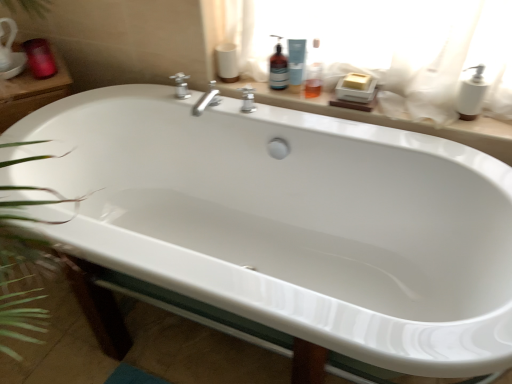
Question: Are white matte toilet paper at upper center and blue plastic bottle at upper center, acting as the second cleaning product starting from the left, located far from each other?

Choices:
 (A) yes
 (B) no

Answer: (B)

Question: Can we say white matte toilet paper at upper center lies outside blue plastic bottle at upper center, acting as the second cleaning product starting from the left?

Choices:
 (A) yes
 (B) no

Answer: (A)

Question: From a real-world perspective, is white matte toilet paper at upper center over blue plastic bottle at upper center, the first cleaning product in the right-to-left sequence?

Choices:
 (A) no
 (B) yes

Answer: (A)

Question: Does white matte toilet paper at upper center have a smaller size compared to blue plastic bottle at upper center, the first cleaning product in the right-to-left sequence?

Choices:
 (A) no
 (B) yes

Answer: (A)

Question: Considering the relative sizes of white matte toilet paper at upper center and blue plastic bottle at upper center, acting as the second cleaning product starting from the left, in the image provided, is white matte toilet paper at upper center shorter than blue plastic bottle at upper center, acting as the second cleaning product starting from the left,?

Choices:
 (A) yes
 (B) no

Answer: (A)

Question: Is matte red candle at upper left taller or shorter than translucent plastic bottle at upper center, placed as the 2th cleaning product when sorted from right to left?

Choices:
 (A) tall
 (B) short

Answer: (B)

Question: Visually, is matte red candle at upper left positioned to the left or to the right of translucent plastic bottle at upper center, acting as the 1th cleaning product starting from the left?

Choices:
 (A) right
 (B) left

Answer: (B)

Question: From the image's perspective, is matte red candle at upper left positioned above or below translucent plastic bottle at upper center, placed as the 2th cleaning product when sorted from right to left?

Choices:
 (A) above
 (B) below

Answer: (A)

Question: Looking at the image, does matte red candle at upper left seem bigger or smaller compared to translucent plastic bottle at upper center, placed as the 2th cleaning product when sorted from right to left?

Choices:
 (A) big
 (B) small

Answer: (A)

Question: Based on their sizes in the image, would you say white plastic soap dispenser at upper right is bigger or smaller than blue plastic bottle at upper center, the first cleaning product in the right-to-left sequence?

Choices:
 (A) big
 (B) small

Answer: (A)

Question: Based on their positions, is white plastic soap dispenser at upper right located to the left or right of blue plastic bottle at upper center, the first cleaning product in the right-to-left sequence?

Choices:
 (A) right
 (B) left

Answer: (A)

Question: From the image's perspective, is white plastic soap dispenser at upper right located above or below blue plastic bottle at upper center, the first cleaning product in the right-to-left sequence?

Choices:
 (A) below
 (B) above

Answer: (A)

Question: Is white plastic soap dispenser at upper right wider or thinner than blue plastic bottle at upper center, acting as the second cleaning product starting from the left?

Choices:
 (A) thin
 (B) wide

Answer: (A)

Question: From a real-world perspective, relative to matte beige soap dish at upper center, is white matte toilet paper at upper center vertically above or below?

Choices:
 (A) below
 (B) above

Answer: (B)

Question: Considering their positions, is white matte toilet paper at upper center located in front of or behind matte beige soap dish at upper center?

Choices:
 (A) front
 (B) behind

Answer: (B)